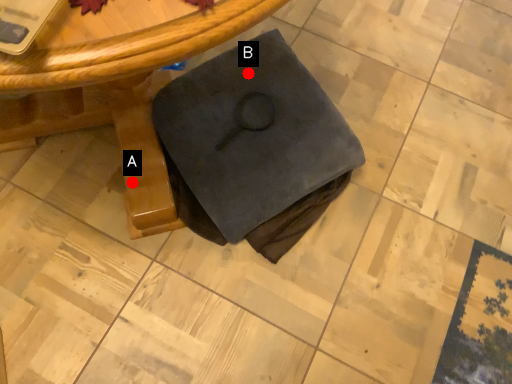
Question: Two points are circled on the image, labeled by A and B beside each circle. Among these points, which one is farthest from the camera?

Choices:
 (A) A is further
 (B) B is further

Answer: (B)